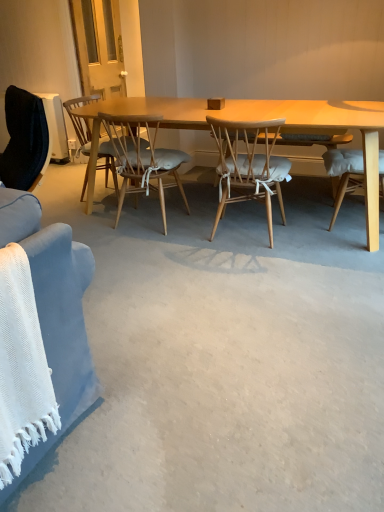
Find the location of a particular element. The image size is (384, 512). empty space that is to the right of light brown wood chair at center, the second chair in the right-to-left sequence is located at coordinates (199, 217).